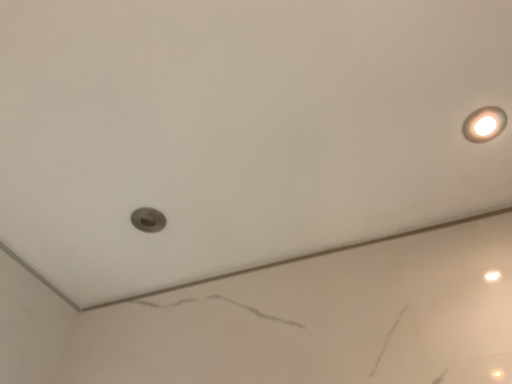
Question: Is matte gray hole at center-left taller or shorter than matte white light fixture at upper right?

Choices:
 (A) tall
 (B) short

Answer: (A)

Question: Is matte gray hole at center-left bigger or smaller than matte white light fixture at upper right?

Choices:
 (A) small
 (B) big

Answer: (B)

Question: From a real-world perspective, is matte gray hole at center-left positioned above or below matte white light fixture at upper right?

Choices:
 (A) above
 (B) below

Answer: (A)

Question: Is matte white light fixture at upper right spatially inside matte gray hole at center-left, or outside of it?

Choices:
 (A) outside
 (B) inside

Answer: (A)

Question: Considering their positions, is matte white light fixture at upper right located in front of or behind matte gray hole at center-left?

Choices:
 (A) behind
 (B) front

Answer: (B)

Question: From a real-world perspective, is matte white light fixture at upper right positioned above or below matte gray hole at center-left?

Choices:
 (A) below
 (B) above

Answer: (A)

Question: Is point (486, 119) closer or farther from the camera than point (139, 210)?

Choices:
 (A) closer
 (B) farther

Answer: (A)